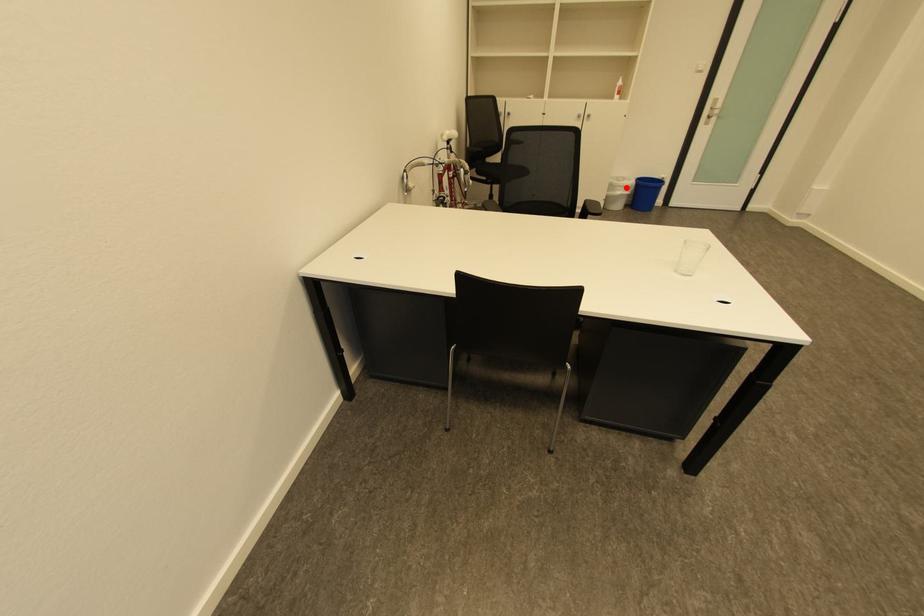
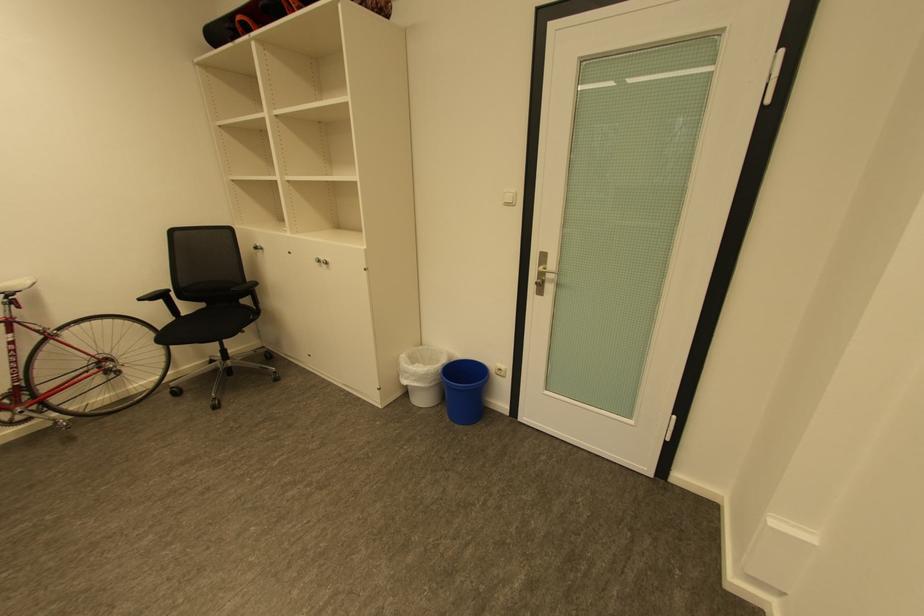
Where in the second image is the point corresponding to the highlighted location from the first image?

(414, 373)